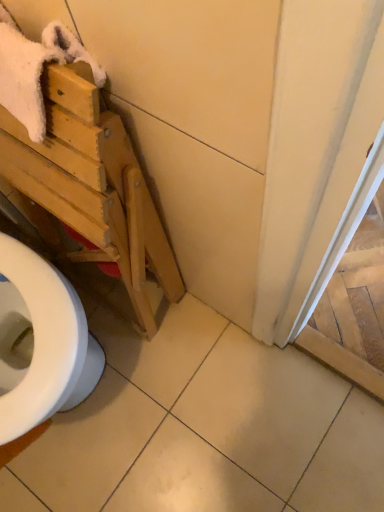
Question: Considering the relative sizes of white fluffy bath towel at upper left and light wood folding chair at left in the image provided, is white fluffy bath towel at upper left taller than light wood folding chair at left?

Choices:
 (A) no
 (B) yes

Answer: (A)

Question: From a real-world perspective, is white fluffy bath towel at upper left positioned over light wood folding chair at left based on gravity?

Choices:
 (A) yes
 (B) no

Answer: (A)

Question: From the image's perspective, is white fluffy bath towel at upper left located above light wood folding chair at left?

Choices:
 (A) no
 (B) yes

Answer: (B)

Question: From the image's perspective, is white fluffy bath towel at upper left below light wood folding chair at left?

Choices:
 (A) yes
 (B) no

Answer: (B)

Question: Is white fluffy bath towel at upper left facing away from light wood folding chair at left?

Choices:
 (A) yes
 (B) no

Answer: (A)

Question: Is white fluffy bath towel at upper left outside light wood folding chair at left?

Choices:
 (A) no
 (B) yes

Answer: (A)

Question: Is white fluffy bath towel at upper left looking in the opposite direction of white tile at center?

Choices:
 (A) yes
 (B) no

Answer: (B)

Question: Can you confirm if white fluffy bath towel at upper left is shorter than white tile at center?

Choices:
 (A) no
 (B) yes

Answer: (A)

Question: Considering the relative sizes of white fluffy bath towel at upper left and white tile at center in the image provided, is white fluffy bath towel at upper left bigger than white tile at center?

Choices:
 (A) yes
 (B) no

Answer: (B)

Question: From the image's perspective, is white fluffy bath towel at upper left over white tile at center?

Choices:
 (A) yes
 (B) no

Answer: (A)

Question: Considering the relative positions of white fluffy bath towel at upper left and white tile at center in the image provided, is white fluffy bath towel at upper left behind white tile at center?

Choices:
 (A) yes
 (B) no

Answer: (B)

Question: Does white fluffy bath towel at upper left have a greater width compared to white tile at center?

Choices:
 (A) no
 (B) yes

Answer: (A)

Question: From a real-world perspective, is light wood folding chair at left below white tile at center?

Choices:
 (A) yes
 (B) no

Answer: (B)